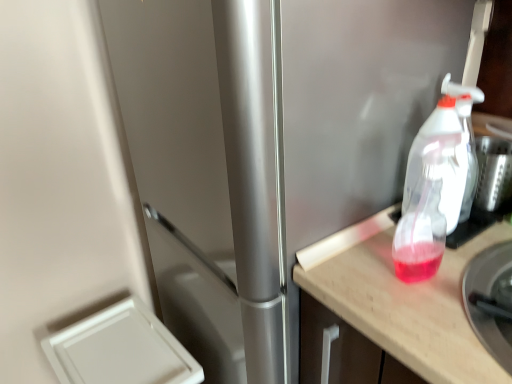
Where is `vacant area situated to the left side of translucent plastic spray bottle at right`? Image resolution: width=512 pixels, height=384 pixels. vacant area situated to the left side of translucent plastic spray bottle at right is located at coordinates (355, 277).